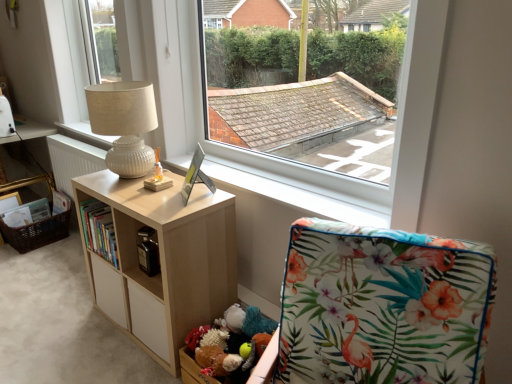
Question: Can you confirm if white glossy radiator at left is smaller than light wood/texture bookshelf at center?

Choices:
 (A) yes
 (B) no

Answer: (A)

Question: Is white glossy radiator at left located outside light wood/texture bookshelf at center?

Choices:
 (A) yes
 (B) no

Answer: (A)

Question: Does white glossy radiator at left lie in front of light wood/texture bookshelf at center?

Choices:
 (A) yes
 (B) no

Answer: (B)

Question: Is white glossy radiator at left positioned with its back to light wood/texture bookshelf at center?

Choices:
 (A) yes
 (B) no

Answer: (B)

Question: Does white glossy radiator at left appear on the left side of light wood/texture bookshelf at center?

Choices:
 (A) no
 (B) yes

Answer: (B)

Question: Considering the positions of white textured lamp at upper left and white wooden window sill at center in the image, is white textured lamp at upper left wider or thinner than white wooden window sill at center?

Choices:
 (A) thin
 (B) wide

Answer: (B)

Question: Considering the positions of point (138, 139) and point (185, 162), is point (138, 139) closer or farther from the camera than point (185, 162)?

Choices:
 (A) farther
 (B) closer

Answer: (B)

Question: Would you say white textured lamp at upper left is to the left or to the right of white wooden window sill at center in the picture?

Choices:
 (A) right
 (B) left

Answer: (B)

Question: Is white textured lamp at upper left spatially inside white wooden window sill at center, or outside of it?

Choices:
 (A) inside
 (B) outside

Answer: (B)

Question: Considering their positions, is hardcover book at center located in front of or behind beige fabric lampshade at upper left, which is the first window in left-to-right order?

Choices:
 (A) behind
 (B) front

Answer: (B)

Question: Looking at their shapes, would you say hardcover book at center is wider or thinner than beige fabric lampshade at upper left, which is the first window in left-to-right order?

Choices:
 (A) wide
 (B) thin

Answer: (B)

Question: Is point (108, 228) positioned closer to the camera than point (112, 14)?

Choices:
 (A) closer
 (B) farther

Answer: (A)

Question: Based on their sizes in the image, would you say hardcover book at center is bigger or smaller than beige fabric lampshade at upper left, which is the first window in left-to-right order?

Choices:
 (A) big
 (B) small

Answer: (B)

Question: From the image's perspective, relative to white glossy radiator at left, is brown woven basket at lower left above or below?

Choices:
 (A) below
 (B) above

Answer: (A)

Question: From a real-world perspective, is brown woven basket at lower left above or below white glossy radiator at left?

Choices:
 (A) below
 (B) above

Answer: (A)